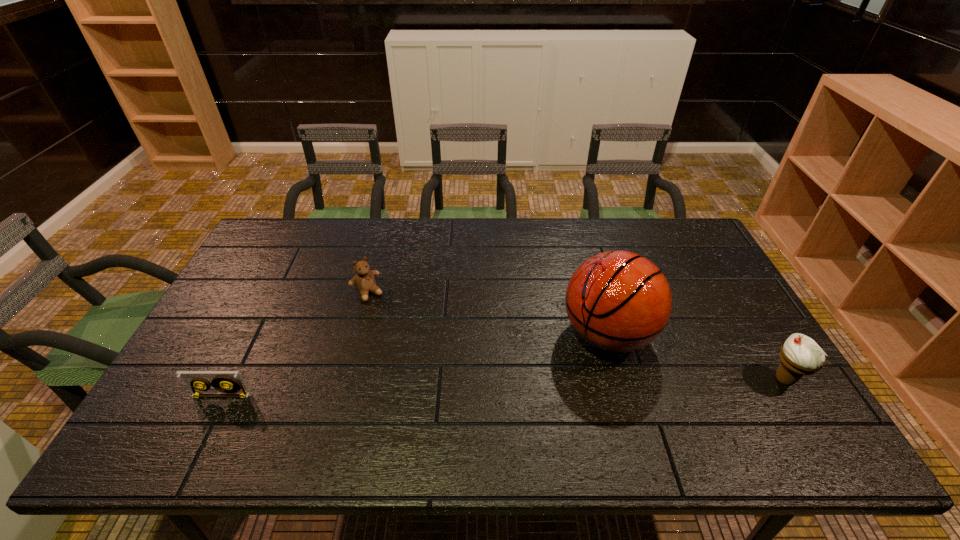
I want to click on vacant space that's between the third shortest object and the second object from right to left, so click(x=696, y=357).

Find the location of `free point between the third object from left to right and the shortest object`. free point between the third object from left to right and the shortest object is located at coordinates (415, 365).

The width and height of the screenshot is (960, 540). I want to click on empty location between the third shortest object and the basketball, so point(696,357).

Where is `unoccupied position between the second tallest object and the shortest object`? unoccupied position between the second tallest object and the shortest object is located at coordinates (503, 387).

At what (x,y) coordinates should I click in order to perform the action: click on vacant area between the third object from left to right and the second object from left to right. Please return your answer as a coordinate pair (x, y). This screenshot has height=540, width=960. Looking at the image, I should click on (488, 314).

This screenshot has height=540, width=960. Identify the location of vacant space that's between the icecream and the teddy bear. (576, 336).

Where is `free space between the leftmost object and the second tallest object`? This screenshot has width=960, height=540. free space between the leftmost object and the second tallest object is located at coordinates (503, 387).

Where is `vacant point located between the videotape and the third tallest object`? vacant point located between the videotape and the third tallest object is located at coordinates (295, 344).

The width and height of the screenshot is (960, 540). I want to click on unoccupied position between the second object from left to right and the icecream, so click(x=576, y=336).

Where is `the closest object to the videotape`? The height and width of the screenshot is (540, 960). the closest object to the videotape is located at coordinates (364, 280).